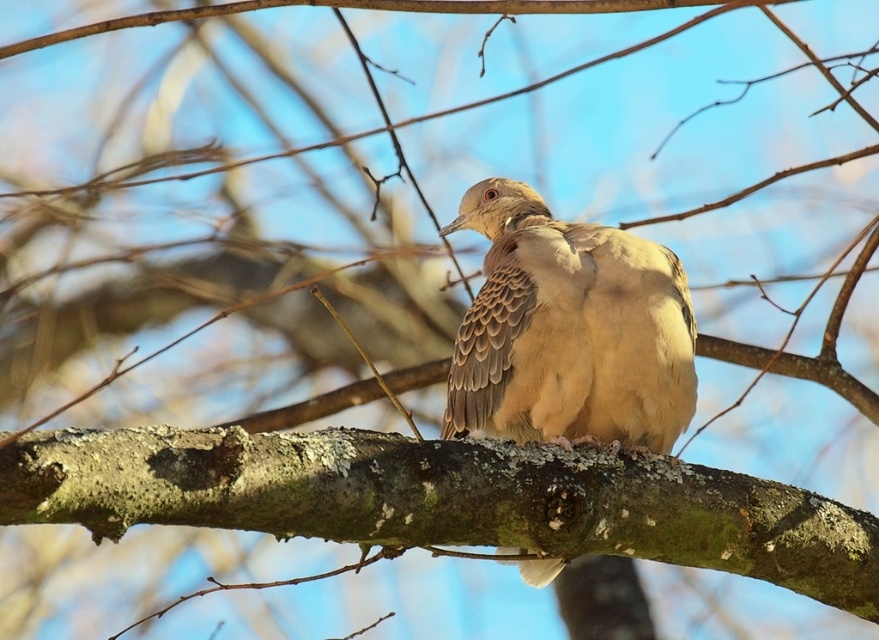
You are a wildlife photographer aiming to capture a closeup of the brown speckled feathers at center and the green mossy branch at center in the same frame. Given that your camera lens has a maximum focus range of 45 centimeters, will you be able to capture both subjects clearly in one shot?

The green mossy branch at center and brown speckled feathers at center are 45.23 centimeters apart. Since the distance between them exceeds the camera lens maximum focus range of 45 centimeters, you will not be able to capture both subjects clearly in one shot.

You are a birdwatcher observing the scene. You notice the green mossy branch at center and the brown speckled feathers at center. Which object is taller in this image?

The brown speckled feathers at center are taller than the green mossy branch at center.

You are standing in a forest and see two points in the image. The first point is labeled as point (71, 452) and the second is point (578, 348). Which point is nearer to you?

Point (71, 452) is closer to the viewer than point (578, 348).